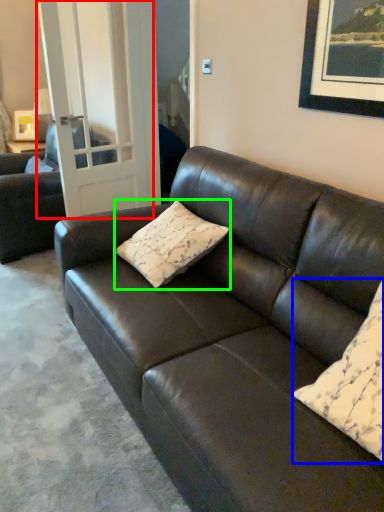
Question: Which object is positioned farthest from glass door (highlighted by a red box)? Select from pillow (highlighted by a blue box) and pillow (highlighted by a green box).

Choices:
 (A) pillow
 (B) pillow

Answer: (A)